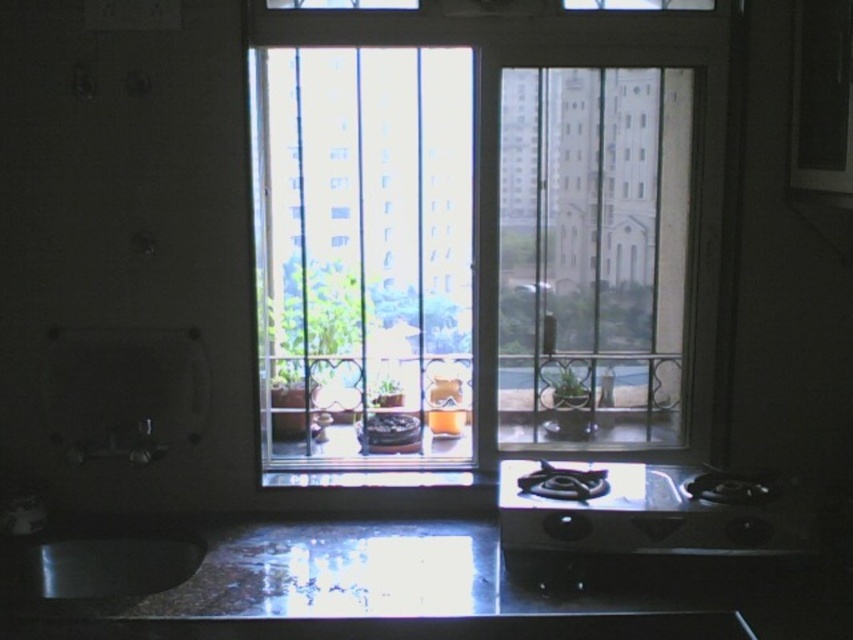
Question: Estimate the real-world distances between objects in this image. Which object is farther from the glossy granite counter top at lower center?

Choices:
 (A) green matte plant at center
 (B) shiny metallic sink at lower left
 (C) clear glass window at center

Answer: (A)

Question: Does glossy granite counter top at lower center have a lesser width compared to green matte plant at center?

Choices:
 (A) no
 (B) yes

Answer: (A)

Question: Is clear glass window at center to the right of shiny metallic sink at lower left from the viewer's perspective?

Choices:
 (A) no
 (B) yes

Answer: (B)

Question: Does glossy granite counter top at lower center appear over green matte plant at center?

Choices:
 (A) no
 (B) yes

Answer: (A)

Question: Estimate the real-world distances between objects in this image. Which object is closer to the green matte plant at center?

Choices:
 (A) shiny metallic sink at lower left
 (B) clear glass window at center
 (C) glossy granite counter top at lower center

Answer: (B)

Question: Which point is farther from the camera taking this photo?

Choices:
 (A) (123, 540)
 (B) (155, 608)

Answer: (A)